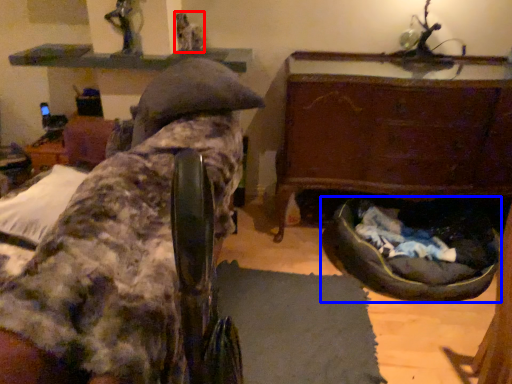
Question: Among these objects, which one is farthest to the camera, person (highlighted by a red box) or dog bed (highlighted by a blue box)?

Choices:
 (A) person
 (B) dog bed

Answer: (A)